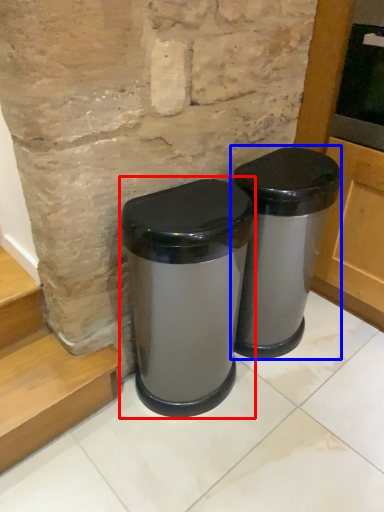
Question: Which of the following is the farthest to the observer, waste container (highlighted by a red box) or waste container (highlighted by a blue box)?

Choices:
 (A) waste container
 (B) waste container

Answer: (B)